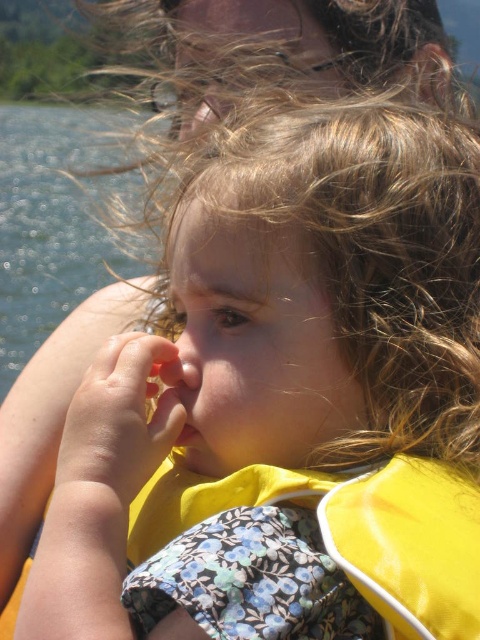
The child in the image is wearing a yellow fabric life jacket at center and has a smooth flesh nose at center. Which object is positioned lower in the image?

The yellow fabric life jacket at center is positioned below the smooth flesh nose at center, so the yellow fabric life jacket at center is lower in the image.

Based on the scene described, if you were to draw a straight line from the clear water at left to the smooth flesh nose at center, in which direction would the line point?

The line would point to the right because the clear water at left is positioned to the left of the smooth flesh nose at center.

Based on the scene description, where is the yellow fabric life jacket at center located in terms of coordinates?

The yellow fabric life jacket at center is located at coordinates point (350,531).